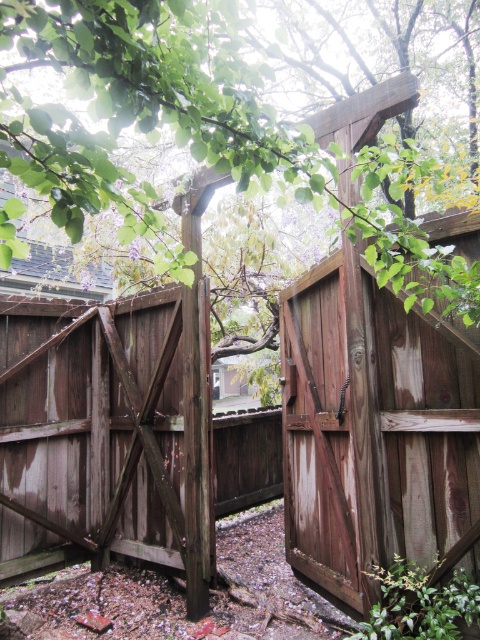
Question: Which object appears farthest from the camera in this image?

Choices:
 (A) green wood tree at upper center
 (B) weathered brown wooden gate at center

Answer: (B)

Question: Which point is closer to the camera?

Choices:
 (A) weathered brown wooden gate at center
 (B) green wood tree at upper center

Answer: (B)

Question: Does green wood tree at upper center have a greater width compared to weathered brown wooden gate at center?

Choices:
 (A) no
 (B) yes

Answer: (B)

Question: Does green wood tree at upper center appear under weathered brown wooden gate at center?

Choices:
 (A) yes
 (B) no

Answer: (B)

Question: Does green wood tree at upper center have a larger size compared to weathered brown wooden gate at center?

Choices:
 (A) yes
 (B) no

Answer: (B)